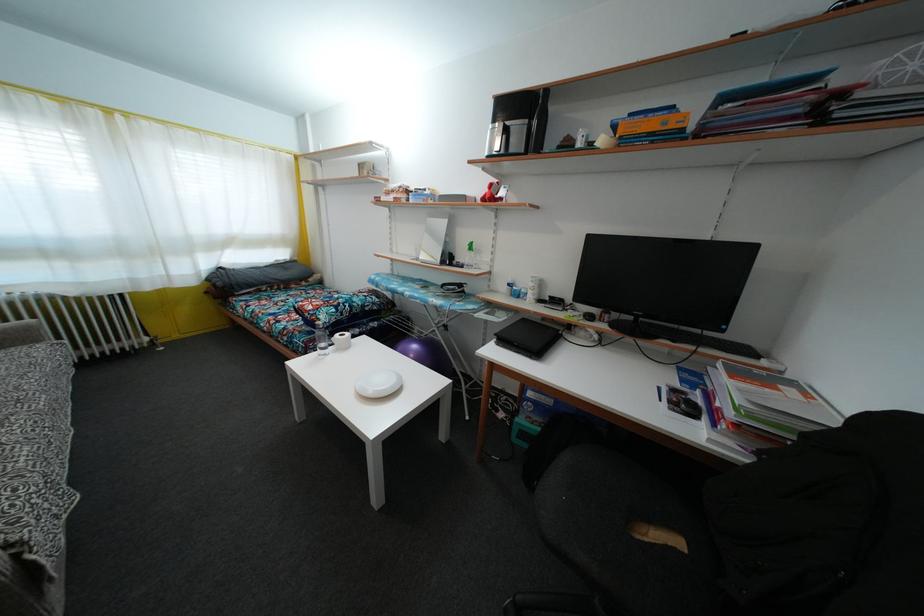
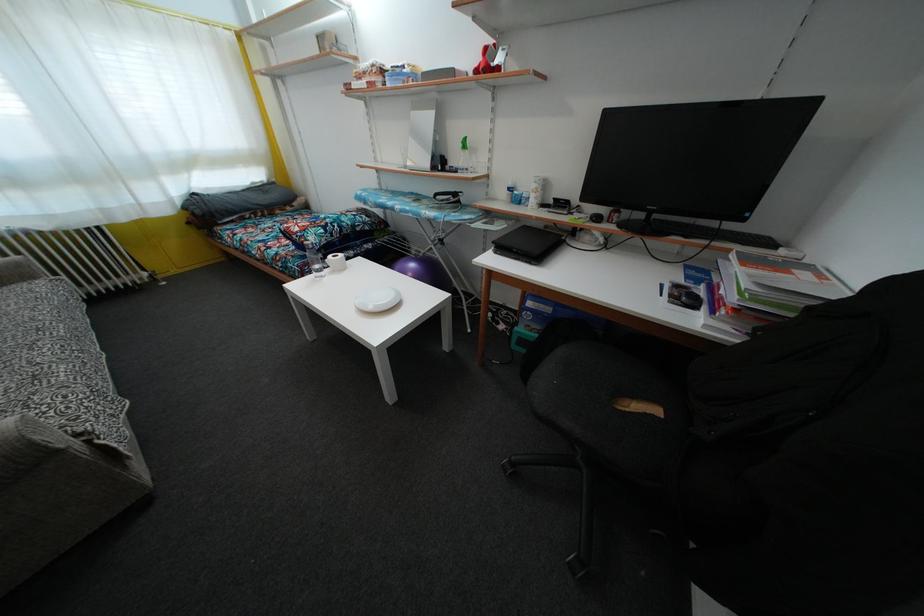
Find the pixel in the second image that matches [386,390] in the first image.

(385, 306)